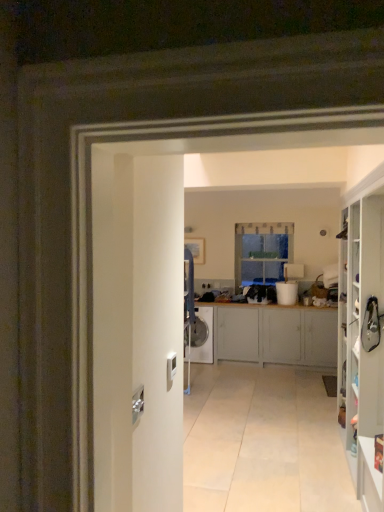
Locate an element on the screen. Image resolution: width=384 pixels, height=512 pixels. clear glass window at center is located at coordinates (262, 252).

In order to face matte gray cabinet at center, which is counted as the 1th cabinetry, starting from the back, should I rotate leftwards or rightwards?

Turn right by 9.224 degrees to look at matte gray cabinet at center, which is counted as the 1th cabinetry, starting from the back.

This screenshot has width=384, height=512. I want to click on clear glass window at center, so click(262, 252).

Considering the sizes of objects clear glass window at center and white glossy washing machine at center in the image provided, who is bigger, clear glass window at center or white glossy washing machine at center?

Bigger between the two is white glossy washing machine at center.

Is white glossy washing machine at center at the back of clear glass window at center?

No.

This screenshot has height=512, width=384. In order to click on window lying on the right of white glossy washing machine at center in this screenshot , I will do `click(262, 252)`.

From the picture: Which is farther, (273, 230) or (198, 338)?

The point (273, 230) is farther.

Is matte gray cabinet at center, positioned as the 2th cabinetry in front-to-back order, at the back of white glossy washing machine at center?

Yes, white glossy washing machine at center's orientation is away from matte gray cabinet at center, positioned as the 2th cabinetry in front-to-back order.

Is matte gray cabinet at center, which is counted as the 1th cabinetry, starting from the back, inside white glossy washing machine at center?

No, matte gray cabinet at center, which is counted as the 1th cabinetry, starting from the back, is located outside of white glossy washing machine at center.

Considering the relative sizes of white glossy washing machine at center and matte gray cabinet at center, positioned as the 2th cabinetry in front-to-back order, in the image provided, is white glossy washing machine at center taller than matte gray cabinet at center, positioned as the 2th cabinetry in front-to-back order,?

Incorrect, the height of white glossy washing machine at center is not larger of that of matte gray cabinet at center, positioned as the 2th cabinetry in front-to-back order.

From the image's perspective, does white glossy washing machine at center appear higher than matte gray cabinet at center, which is counted as the 1th cabinetry, starting from the back?

No, from the image's perspective, white glossy washing machine at center is not above matte gray cabinet at center, which is counted as the 1th cabinetry, starting from the back.

Is matte gray cabinet at center, positioned as the 2th cabinetry in front-to-back order, to the left or to the right of clear glass window at center in the image?

Clearly, matte gray cabinet at center, positioned as the 2th cabinetry in front-to-back order, is on the left of clear glass window at center in the image.

Is matte gray cabinet at center, positioned as the 2th cabinetry in front-to-back order, wider or thinner than clear glass window at center?

In the image, matte gray cabinet at center, positioned as the 2th cabinetry in front-to-back order, appears to be wider than clear glass window at center.

Can you see matte gray cabinet at center, which is counted as the 1th cabinetry, starting from the back, touching clear glass window at center?

No, matte gray cabinet at center, which is counted as the 1th cabinetry, starting from the back, is not touching clear glass window at center.

Is clear glass window at center located within matte gray cabinet at center, positioned as the 2th cabinetry in front-to-back order?

That's incorrect, clear glass window at center is not inside matte gray cabinet at center, positioned as the 2th cabinetry in front-to-back order.

Looking at this image, is matte gray cabinet at center, which is counted as the 1th cabinetry, starting from the back, aimed at white glossy washing machine at center?

Yes, matte gray cabinet at center, which is counted as the 1th cabinetry, starting from the back, is turned towards white glossy washing machine at center.

Locate an element on the screen. Image resolution: width=384 pixels, height=512 pixels. the 1st cabinetry positioned above the white glossy washing machine at center (from a real-world perspective) is located at coordinates (275, 335).

Does point (287, 309) lie behind point (196, 315)?

No.

From the image's perspective, between matte gray cabinet at center, which is counted as the 1th cabinetry, starting from the back, and white glossy washing machine at center, who is located below?

white glossy washing machine at center.

Who is smaller, clear glass window at center or matte gray cabinet at center, which is counted as the 1th cabinetry, starting from the back?

clear glass window at center is smaller.

Which of these two, clear glass window at center or matte gray cabinet at center, which is counted as the 1th cabinetry, starting from the back, stands taller?

With more height is clear glass window at center.

Looking at this image, from the image's perspective, is clear glass window at center above or below matte gray cabinet at center, positioned as the 2th cabinetry in front-to-back order?

clear glass window at center is above matte gray cabinet at center, positioned as the 2th cabinetry in front-to-back order.

From a real-world perspective, is white glossy cabinet at right, which is the first cabinetry in front-to-back order, on top of white glossy washing machine at center?

Yes, from a real-world perspective, white glossy cabinet at right, which is the first cabinetry in front-to-back order, is on top of white glossy washing machine at center.

Which object is thinner, white glossy cabinet at right, which is the first cabinetry in front-to-back order, or white glossy washing machine at center?

white glossy cabinet at right, which is the first cabinetry in front-to-back order, is thinner.

Does white glossy cabinet at right, the second cabinetry viewed from the back, lie in front of white glossy washing machine at center?

Yes, it is in front of white glossy washing machine at center.

Looking at this image, is white glossy cabinet at right, which is the first cabinetry in front-to-back order, located within clear glass window at center?

Actually, white glossy cabinet at right, which is the first cabinetry in front-to-back order, is outside clear glass window at center.

Identify the location of cabinetry on the right side of clear glass window at center. The height and width of the screenshot is (512, 384). (361, 336).

Consider the image. Which is in front, clear glass window at center or white glossy cabinet at right, which is the first cabinetry in front-to-back order?

Positioned in front is white glossy cabinet at right, which is the first cabinetry in front-to-back order.

From the image's perspective, is clear glass window at center positioned above or below white glossy cabinet at right, the second cabinetry viewed from the back?

Based on their image positions, clear glass window at center is located above white glossy cabinet at right, the second cabinetry viewed from the back.

Find the location of a particular element. This screenshot has width=384, height=512. window above the white glossy washing machine at center (from a real-world perspective) is located at coordinates (262, 252).

Locate an element on the screen. The width and height of the screenshot is (384, 512). the 1st cabinetry in front when counting from the white glossy washing machine at center is located at coordinates (275, 335).

From the image, which object appears to be nearer to matte gray cabinet at center, which is counted as the 1th cabinetry, starting from the back, white glossy cabinet at right, which is the first cabinetry in front-to-back order, or white glossy washing machine at center?

white glossy washing machine at center is positioned closer to the anchor matte gray cabinet at center, which is counted as the 1th cabinetry, starting from the back.

Based on their spatial positions, is clear glass window at center or white glossy cabinet at right, which is the first cabinetry in front-to-back order, further from matte gray cabinet at center, positioned as the 2th cabinetry in front-to-back order?

white glossy cabinet at right, which is the first cabinetry in front-to-back order.

Based on their spatial positions, is clear glass window at center or matte gray cabinet at center, which is counted as the 1th cabinetry, starting from the back, further from white glossy washing machine at center?

The object further to white glossy washing machine at center is clear glass window at center.

When comparing their distances from clear glass window at center, does matte gray cabinet at center, positioned as the 2th cabinetry in front-to-back order, or white glossy washing machine at center seem closer?

matte gray cabinet at center, positioned as the 2th cabinetry in front-to-back order, is positioned closer to the anchor clear glass window at center.

Considering their positions, is matte gray cabinet at center, positioned as the 2th cabinetry in front-to-back order, positioned closer to white glossy cabinet at right, the second cabinetry viewed from the back, than white glossy washing machine at center?

Based on the image, matte gray cabinet at center, positioned as the 2th cabinetry in front-to-back order, appears to be nearer to white glossy cabinet at right, the second cabinetry viewed from the back.

When comparing their distances from white glossy cabinet at right, the second cabinetry viewed from the back, does white glossy washing machine at center or matte gray cabinet at center, positioned as the 2th cabinetry in front-to-back order, seem closer?

Among the two, matte gray cabinet at center, positioned as the 2th cabinetry in front-to-back order, is located nearer to white glossy cabinet at right, the second cabinetry viewed from the back.

Consider the image. When comparing their distances from white glossy washing machine at center, does matte gray cabinet at center, which is counted as the 1th cabinetry, starting from the back, or clear glass window at center seem further?

The object further to white glossy washing machine at center is clear glass window at center.

Which object lies nearer to the anchor point clear glass window at center, white glossy cabinet at right, the second cabinetry viewed from the back, or white glossy washing machine at center?

white glossy washing machine at center is positioned closer to the anchor clear glass window at center.

You are a GUI agent. You are given a task and a screenshot of the screen. Output one action in this format:
    pyautogui.click(x=<x>, y=<y>)
    Task: Click on the washing machine positioned between white glossy cabinet at right, the second cabinetry viewed from the back, and clear glass window at center from near to far
    This screenshot has width=384, height=512.
    Given the screenshot: What is the action you would take?
    pyautogui.click(x=200, y=337)

Where is `cabinetry positioned between white glossy cabinet at right, which is the first cabinetry in front-to-back order, and clear glass window at center from near to far`? The image size is (384, 512). cabinetry positioned between white glossy cabinet at right, which is the first cabinetry in front-to-back order, and clear glass window at center from near to far is located at coordinates (275, 335).

I want to click on cabinetry between white glossy cabinet at right, which is the first cabinetry in front-to-back order, and white glossy washing machine at center in the front-back direction, so click(x=275, y=335).